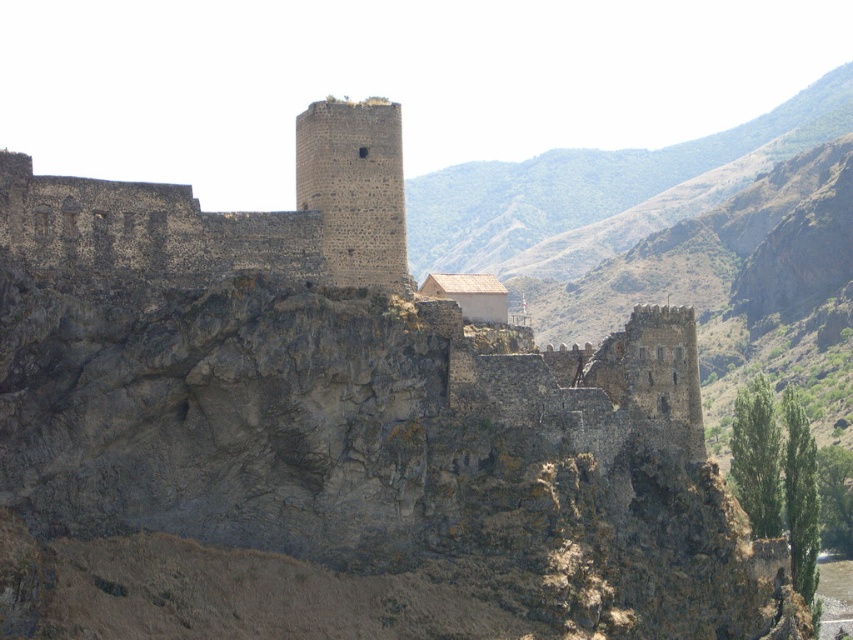
Is dark stone tower at upper center smaller than dark gray stone tower at center?

Incorrect, dark stone tower at upper center is not smaller in size than dark gray stone tower at center.

Between dark stone tower at upper center and dark gray stone tower at center, which one is positioned lower?

dark stone tower at upper center is lower down.

Does point (312, 179) lie behind point (340, 140)?

Yes, it is behind point (340, 140).

Find the location of a particular element. Image resolution: width=853 pixels, height=640 pixels. dark stone tower at upper center is located at coordinates (230, 212).